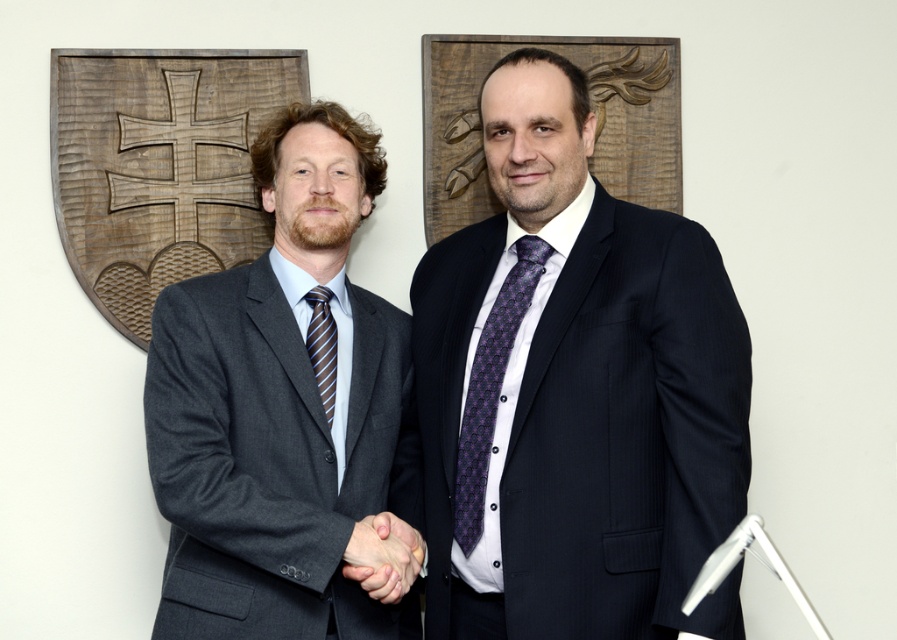
Question: Is matte black suit at center closer to the viewer compared to smooth skin handshake at center?

Choices:
 (A) no
 (B) yes

Answer: (B)

Question: Which point appears closest to the camera in this image?

Choices:
 (A) (485, 321)
 (B) (289, 376)
 (C) (328, 372)
 (D) (577, 186)

Answer: (B)

Question: Among these objects, which one is farthest from the camera?

Choices:
 (A) matte gray suit at left
 (B) matte black suit at center

Answer: (A)

Question: From the image, what is the correct spatial relationship of matte black suit at center in relation to striped silk tie at center?

Choices:
 (A) below
 (B) above

Answer: (B)

Question: Which of these objects is positioned farthest from the matte gray suit at left?

Choices:
 (A) striped silk tie at center
 (B) matte black suit at center
 (C) smooth skin handshake at center

Answer: (B)

Question: Can you confirm if matte gray suit at left is positioned to the left of purple printed tie at center?

Choices:
 (A) no
 (B) yes

Answer: (B)